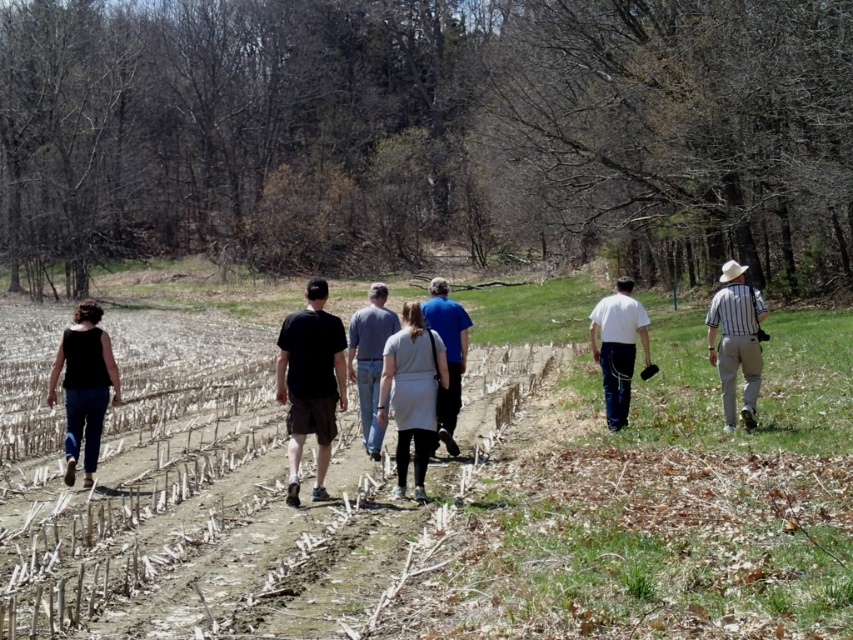
You are standing on the dirt path and notice two people ahead of you. One is wearing black cotton shorts at center and the other is wearing black fabric pants at left. Which person is closer to you?

The black cotton shorts at center is above the black fabric pants at left, meaning the person in black cotton shorts at center is closer to you.

You are standing at the back of the group and want to follow the person wearing black cotton shorts at center. Which direction should you move relative to the black fabric pants at left?

The black cotton shorts at center is in front of the black fabric pants at left, so you should move forward in the direction of the black cotton shorts at center, which is ahead of the black fabric pants at left.

You are a photographer trying to capture a group photo of the six individuals walking along the dirt path. You notice two specific items of clothing in the scene. Which of the two items, the black fabric pants at left or the blue cotton shirt at center, would appear wider in the photo?

The black fabric pants at left would appear wider in the photo because its width is larger than that of the blue cotton shirt at center according to the description.